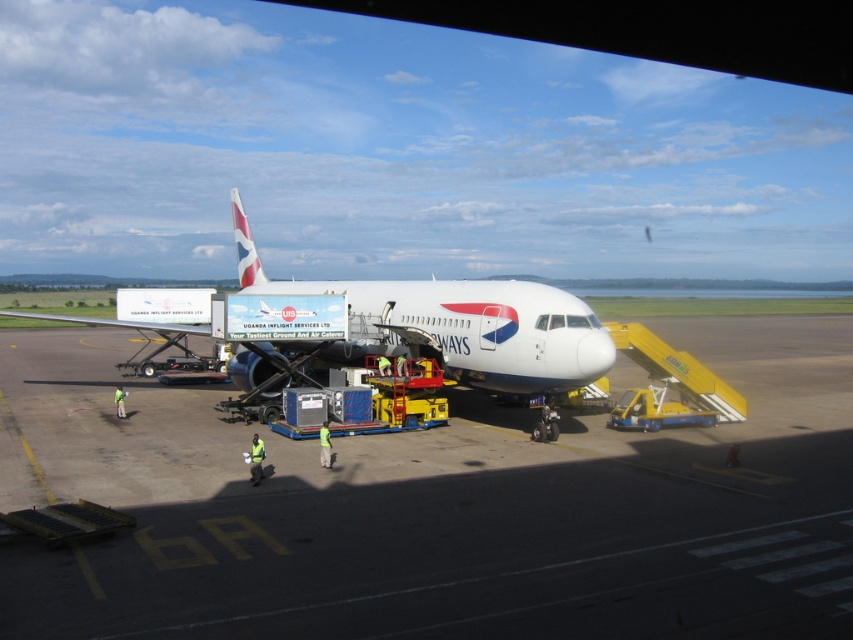
From the picture: You are a delivery driver who needs to park your truck, which is 2.5 meters wide, on the smooth concrete tarmac at center. The white glossy airplane at center is already parked there. Can your truck fit alongside the airplane on the same tarmac without overlapping?

The smooth concrete tarmac at center is wider than the white glossy airplane at center, so yes, the truck can park alongside the airplane on the same tarmac without overlapping as there is enough width available.

You are standing on the airport tarmac and want to take a photo of the white glossy airplane at center. Since you are on the smooth concrete tarmac at center, can you move forward to get a closer shot without walking over any objects?

The smooth concrete tarmac at center is closer to the viewer than the white glossy airplane at center, so you can move forward on the tarmac to get closer to the airplane without needing to walk over any objects between you and the airplane.